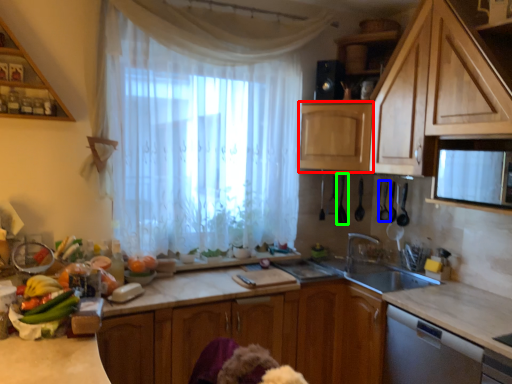
Question: Considering the real-world distances, which object is closest to cabinetry (highlighted by a red box)? appliance (highlighted by a blue box) or appliance (highlighted by a green box).

Choices:
 (A) appliance
 (B) appliance

Answer: (B)